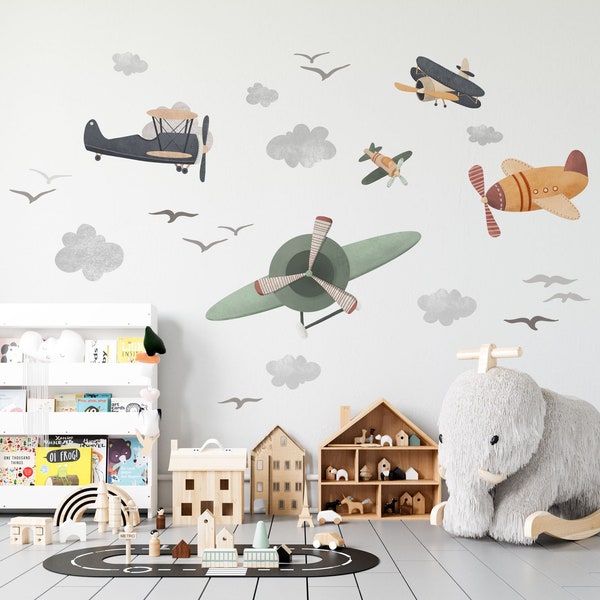
Identify the location of open front doll house. This screenshot has width=600, height=600. (382, 422).